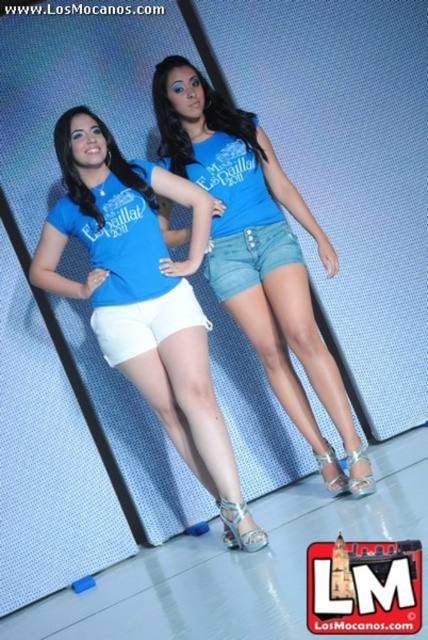
You are a photographer standing at the center of the stage. You notice a point marked at coordinates (259, 253). Which object from the scene is located at this point?

The point at coordinates (259, 253) indicates the location of the matte blue denim shorts at center.